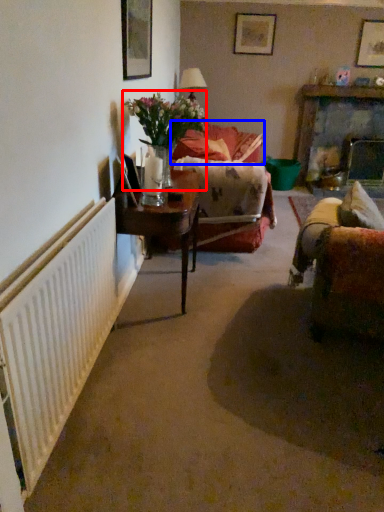
Question: Which point is further to the camera, floral arrangement (highlighted by a red box) or couch (highlighted by a blue box)?

Choices:
 (A) floral arrangement
 (B) couch

Answer: (B)